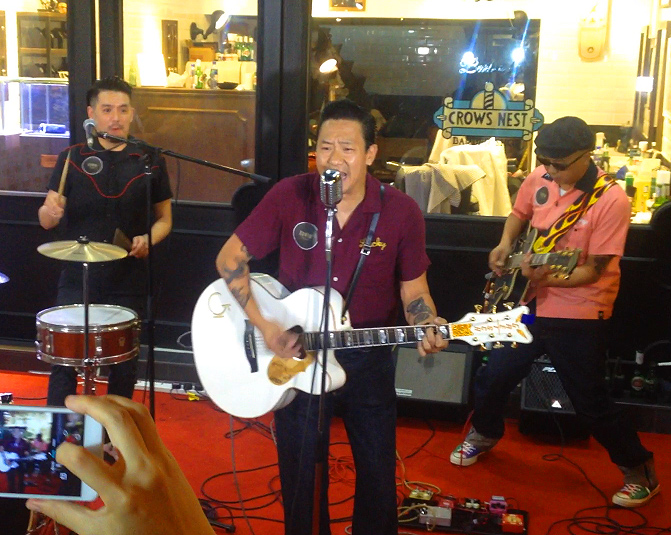
Identify the location of speaker. (439, 378).